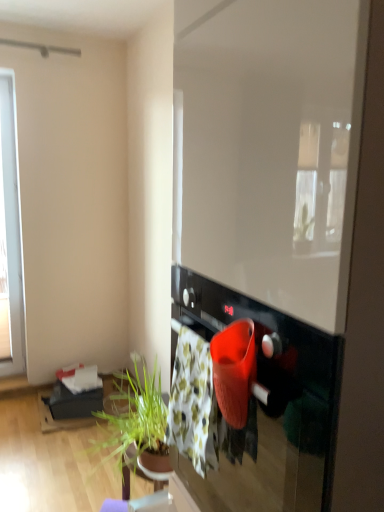
Describe the element at coordinates (269, 405) in the screenshot. I see `black glossy oven at center` at that location.

Describe the element at coordinates (272, 146) in the screenshot. I see `transparent glass window screen at center` at that location.

Identify the location of black glossy oven at center. 269,405.

Does transparent glass window screen at center have a smaller size compared to floral cotton blanket at center?

Actually, transparent glass window screen at center might be larger than floral cotton blanket at center.

Which object is thinner, transparent glass window screen at center or floral cotton blanket at center?

floral cotton blanket at center.

The width and height of the screenshot is (384, 512). In order to click on window screen located above the floral cotton blanket at center (from the image's perspective) in this screenshot , I will do `click(272, 146)`.

Which is more to the right, transparent glass window screen at center or floral cotton blanket at center?

Positioned to the right is transparent glass window screen at center.

This screenshot has height=512, width=384. What are the coordinates of `window screen above the black glossy oven at center (from the image's perspective)` in the screenshot? It's located at (272, 146).

Looking at the image, does transparent glass window screen at center seem bigger or smaller compared to black glossy oven at center?

Clearly, transparent glass window screen at center is larger in size than black glossy oven at center.

Does point (322, 258) come farther from viewer compared to point (219, 441)?

No, (322, 258) is in front of (219, 441).

Considering the relative sizes of transparent glass window screen at center and black glossy oven at center in the image provided, is transparent glass window screen at center taller than black glossy oven at center?

Indeed, transparent glass window screen at center has a greater height compared to black glossy oven at center.

Which is closer, (199, 339) or (255, 243)?

Point (199, 339) is positioned farther from the camera compared to point (255, 243).

Looking at the image, does floral cotton blanket at center seem bigger or smaller compared to transparent glass window screen at center?

Considering their sizes, floral cotton blanket at center takes up less space than transparent glass window screen at center.

Where is `blanket below the transparent glass window screen at center (from a real-world perspective)`? This screenshot has height=512, width=384. blanket below the transparent glass window screen at center (from a real-world perspective) is located at coordinates (193, 403).

Is the position of floral cotton blanket at center more distant than that of transparent glass window screen at center?

Yes, it is behind transparent glass window screen at center.

Looking at this image, from the image's perspective, which one is positioned higher, floral cotton blanket at center or black glossy oven at center?

floral cotton blanket at center, from the image's perspective.

Considering the positions of point (194, 373) and point (301, 417), is point (194, 373) closer or farther from the camera than point (301, 417)?

Point (194, 373) is farther from the camera than point (301, 417).

Find the location of a particular element. The width and height of the screenshot is (384, 512). blanket behind the black glossy oven at center is located at coordinates (193, 403).

Is floral cotton blanket at center closer to the viewer compared to black glossy oven at center?

That is False.

Does black glossy oven at center lie in front of floral cotton blanket at center?

Yes, black glossy oven at center is in front of floral cotton blanket at center.

Would you say black glossy oven at center is a long distance from floral cotton blanket at center?

black glossy oven at center is actually quite close to floral cotton blanket at center.

From the image's perspective, which one is positioned lower, black glossy oven at center or floral cotton blanket at center?

black glossy oven at center is shown below in the image.

Between black glossy oven at center and floral cotton blanket at center, which one has smaller width?

Thinner between the two is floral cotton blanket at center.

From a real-world perspective, which object stands above the other?

In real-world perspective, transparent glass window screen at center is above.

You are a GUI agent. You are given a task and a screenshot of the screen. Output one action in this format:
    pyautogui.click(x=<x>, y=<y>)
    Task: Click on the oven below the transparent glass window screen at center (from a real-world perspective)
    The height and width of the screenshot is (512, 384).
    Given the screenshot: What is the action you would take?
    pyautogui.click(x=269, y=405)

Considering the relative positions of black glossy oven at center and transparent glass window screen at center in the image provided, is black glossy oven at center in front of transparent glass window screen at center?

No, black glossy oven at center is further to the viewer.

From the image's perspective, which object appears higher, black glossy oven at center or transparent glass window screen at center?

From the image's view, transparent glass window screen at center is above.

You are a GUI agent. You are given a task and a screenshot of the screen. Output one action in this format:
    pyautogui.click(x=<x>, y=<y>)
    Task: Click on the window screen in front of the floral cotton blanket at center
    
    Given the screenshot: What is the action you would take?
    pyautogui.click(x=272, y=146)

Locate an element on the screen. This screenshot has height=512, width=384. oven that appears behind the transparent glass window screen at center is located at coordinates (269, 405).

When comparing their distances from floral cotton blanket at center, does transparent glass window screen at center or black glossy oven at center seem closer?

Based on the image, black glossy oven at center appears to be nearer to floral cotton blanket at center.

When comparing their distances from black glossy oven at center, does transparent glass window screen at center or floral cotton blanket at center seem further?

transparent glass window screen at center is further to black glossy oven at center.

Considering their positions, is floral cotton blanket at center positioned closer to transparent glass window screen at center than black glossy oven at center?

black glossy oven at center is positioned closer to the anchor transparent glass window screen at center.

Looking at the image, which one is located further to black glossy oven at center, floral cotton blanket at center or transparent glass window screen at center?

The object further to black glossy oven at center is transparent glass window screen at center.

Based on their spatial positions, is black glossy oven at center or floral cotton blanket at center closer to transparent glass window screen at center?

black glossy oven at center is closer to transparent glass window screen at center.

Considering their positions, is black glossy oven at center positioned closer to floral cotton blanket at center than transparent glass window screen at center?

black glossy oven at center is closer to floral cotton blanket at center.

The width and height of the screenshot is (384, 512). Find the location of `oven between transparent glass window screen at center and floral cotton blanket at center from front to back`. oven between transparent glass window screen at center and floral cotton blanket at center from front to back is located at coordinates (269, 405).